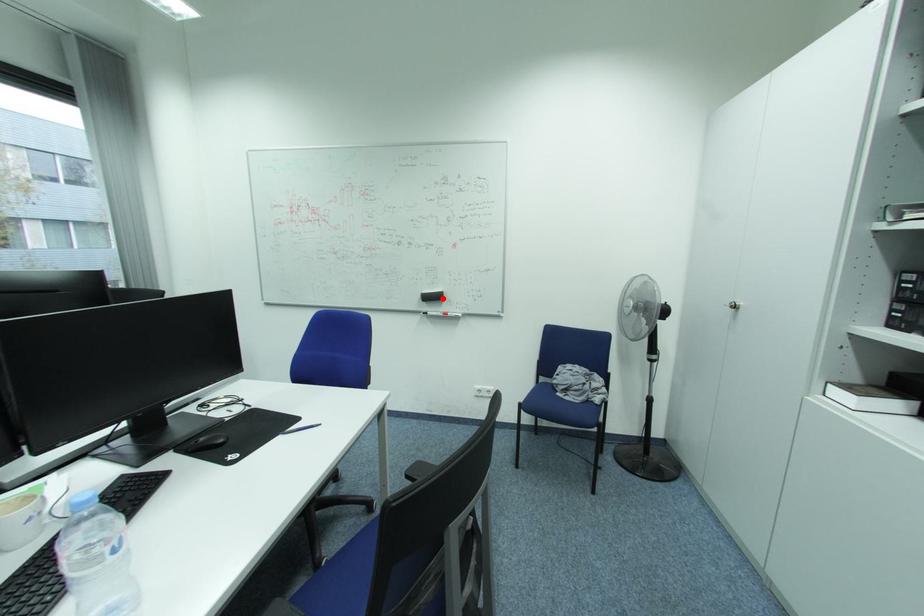
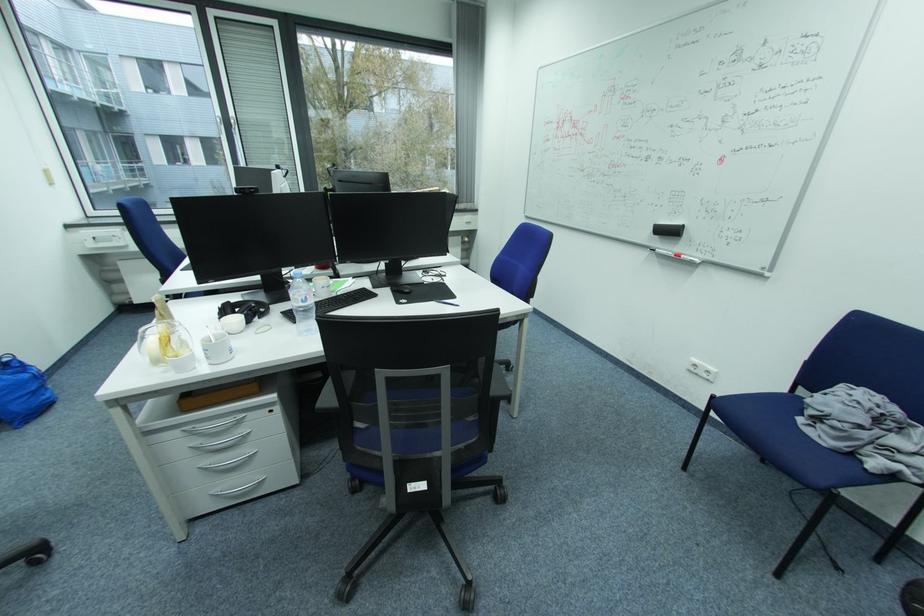
Where in the second image is the point corresponding to the highlighted location from the first image?

(677, 233)